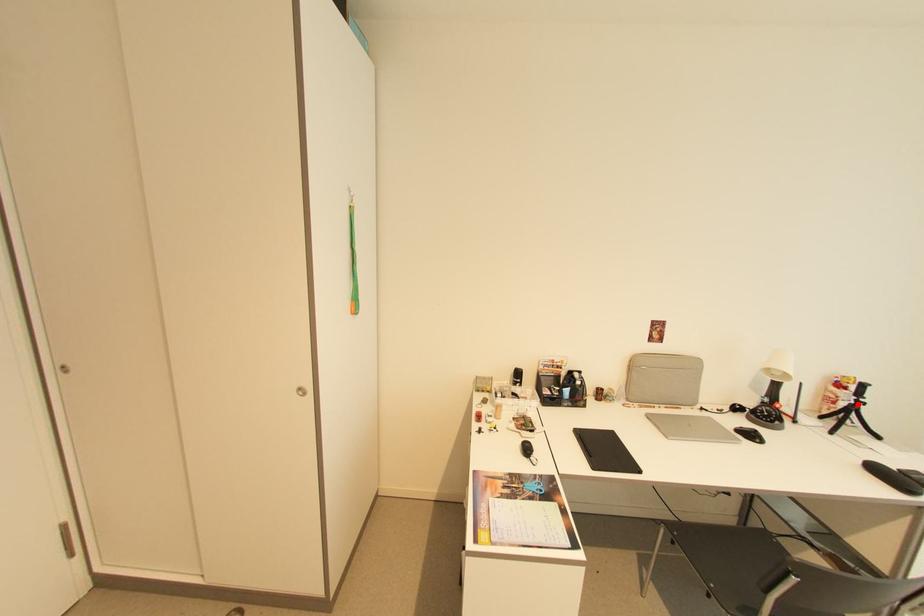
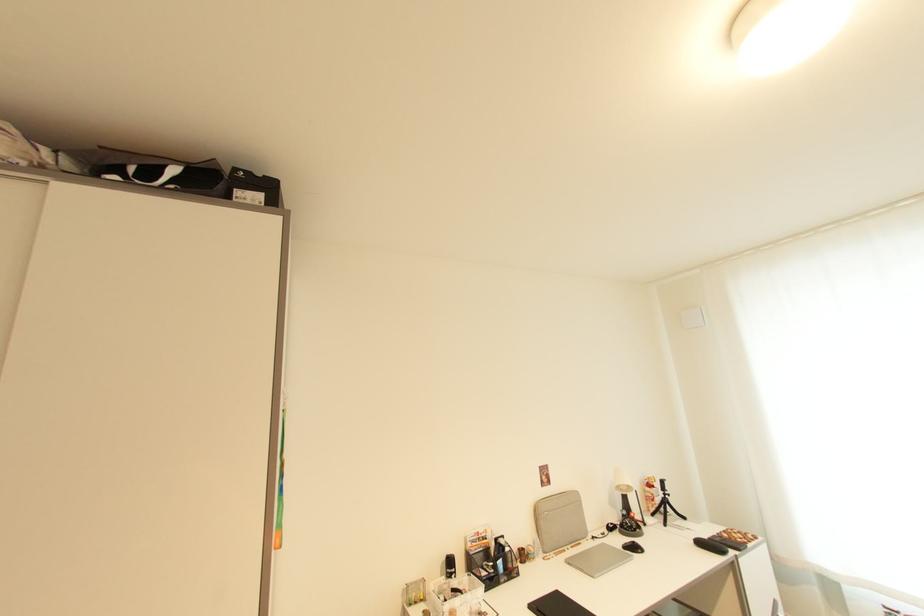
Question: A red point is marked in image1. In image2, is the corresponding 3D point closer to the camera or farther? Reply with the corresponding letter.

Choices:
 (A) The corresponding 3D point is closer.
 (B) The corresponding 3D point is farther.

Answer: (B)